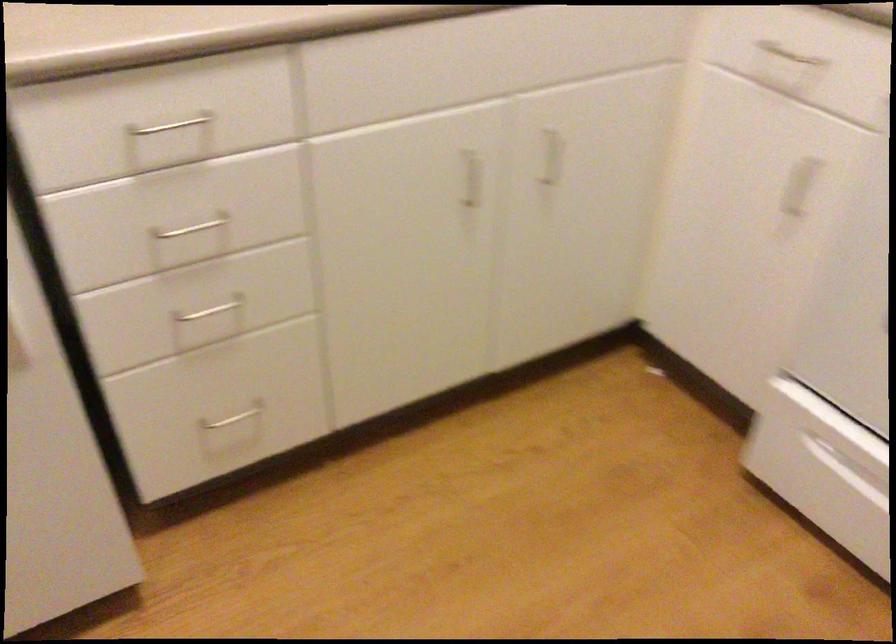
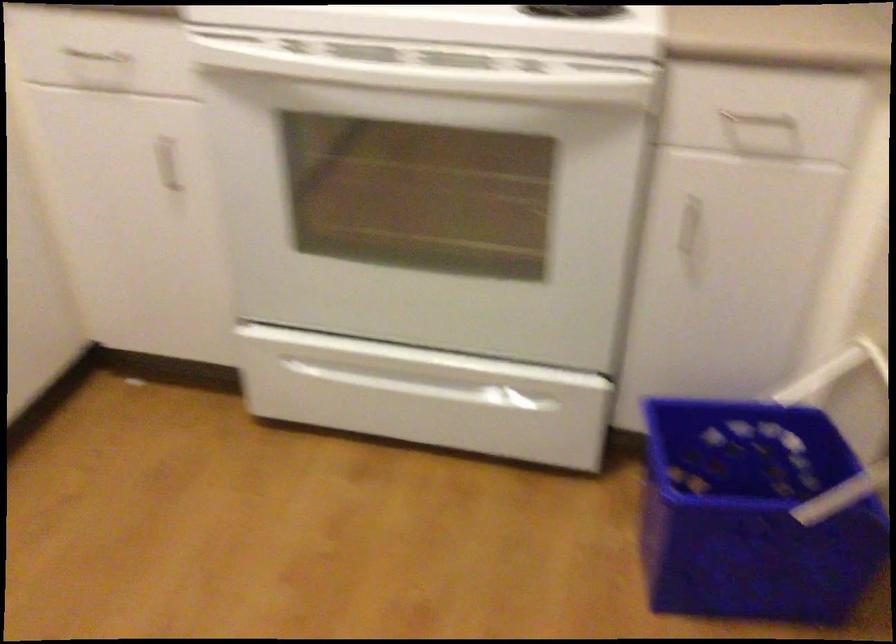
The point at (x=798, y=175) is marked in the first image. Where is the corresponding point in the second image?

(167, 164)